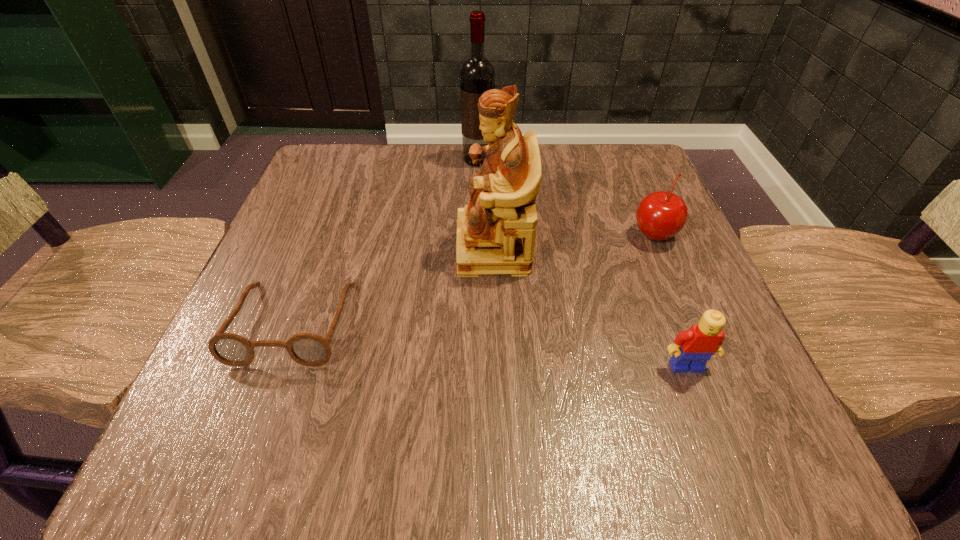
The image size is (960, 540). I want to click on vacant region between the farthest object and the leftmost object, so click(x=386, y=241).

The height and width of the screenshot is (540, 960). I want to click on free space between the figurine and the cherry, so click(573, 240).

At what (x,y) coordinates should I click in order to perform the action: click on vacant area that lies between the Lego and the cherry. Please return your answer as a coordinate pair (x, y). The height and width of the screenshot is (540, 960). Looking at the image, I should click on (670, 300).

This screenshot has width=960, height=540. I want to click on object that stands as the third closest to the farthest object, so click(307, 349).

Locate an element on the screen. the third closest object to the Lego is located at coordinates (307, 349).